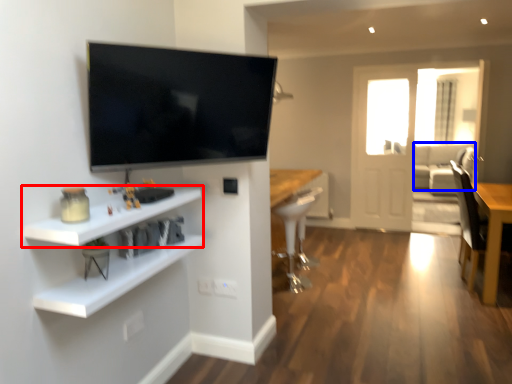
Question: Which of the following is the farthest to the observer, shelf (highlighted by a red box) or couch (highlighted by a blue box)?

Choices:
 (A) shelf
 (B) couch

Answer: (B)